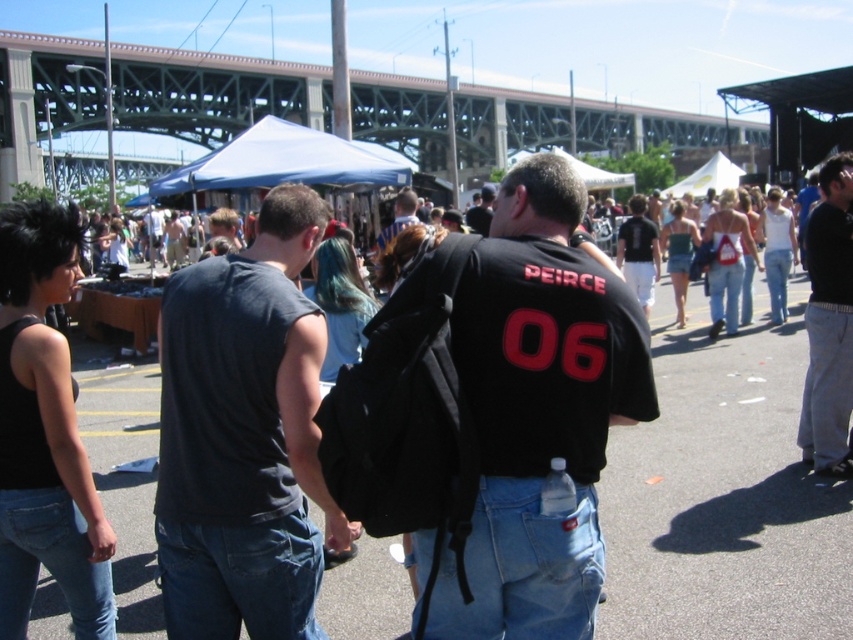
Is blue fabric canopy at upper center taller than blue denim jeans at center?

Yes.

This screenshot has height=640, width=853. Find the location of `blue fabric canopy at upper center`. blue fabric canopy at upper center is located at coordinates (287, 161).

Is black matte jersey at center thinner than gray cotton pants at right?

Yes, black matte jersey at center is thinner than gray cotton pants at right.

In the scene shown: Can you confirm if black matte jersey at center is positioned to the right of gray cotton pants at right?

In fact, black matte jersey at center is to the left of gray cotton pants at right.

You are a GUI agent. You are given a task and a screenshot of the screen. Output one action in this format:
    pyautogui.click(x=<x>, y=<y>)
    Task: Click on the black matte jersey at center
    This screenshot has height=640, width=853.
    Given the screenshot: What is the action you would take?
    538,412

What are the coordinates of `gray cotton pants at right` in the screenshot? It's located at (828, 323).

Between gray cotton pants at right and blue fabric canopy at upper center, which one is positioned lower?

gray cotton pants at right

Is point (846, 188) positioned in front of point (306, 154)?

Yes, point (846, 188) is in front of point (306, 154).

Identify the location of gray cotton pants at right. pos(828,323).